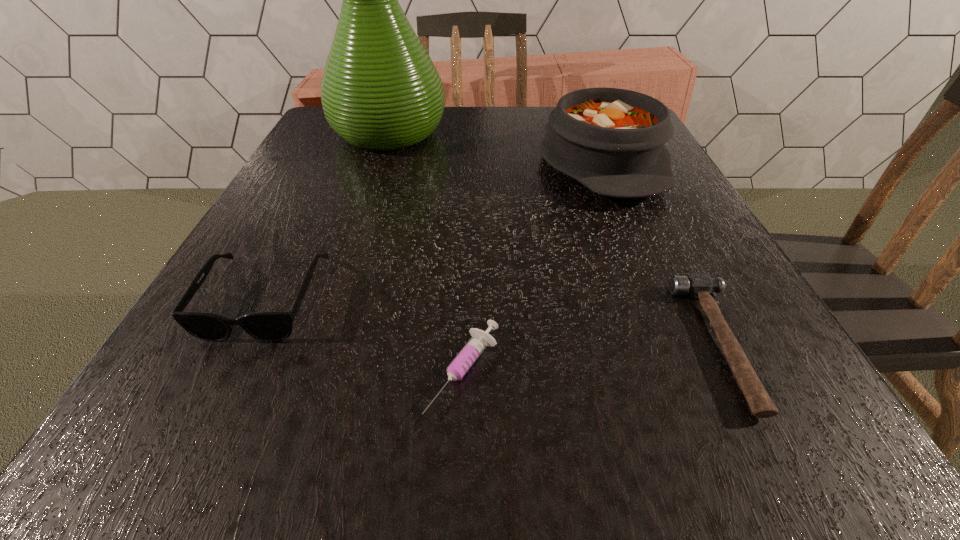
This screenshot has height=540, width=960. I want to click on the tallest object, so click(x=380, y=91).

At what (x,y) coordinates should I click in order to perform the action: click on the second tallest object. Please return your answer as a coordinate pair (x, y). Looking at the image, I should click on (611, 140).

Locate an element on the screen. sunglasses is located at coordinates (267, 326).

Identify the location of hammer. (699, 285).

I want to click on syringe, so click(x=480, y=339).

Identify the location of vacant area situated on the front of the tallest object. The width and height of the screenshot is (960, 540). (362, 213).

Locate an element on the screen. Image resolution: width=960 pixels, height=540 pixels. free space located 0.230m on the left of the casserole is located at coordinates (434, 163).

Identify the location of vacant space located at the front lenses of the sunglasses. (191, 447).

Locate an element on the screen. free location located on the striking face of the hammer is located at coordinates (626, 343).

I want to click on vacant area situated 0.250m on the striking face of the hammer, so click(x=509, y=343).